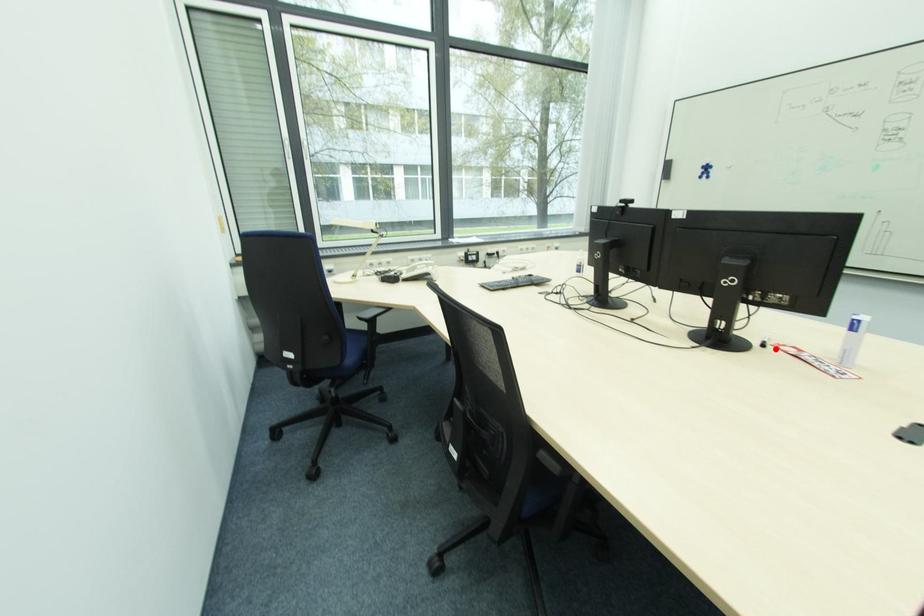
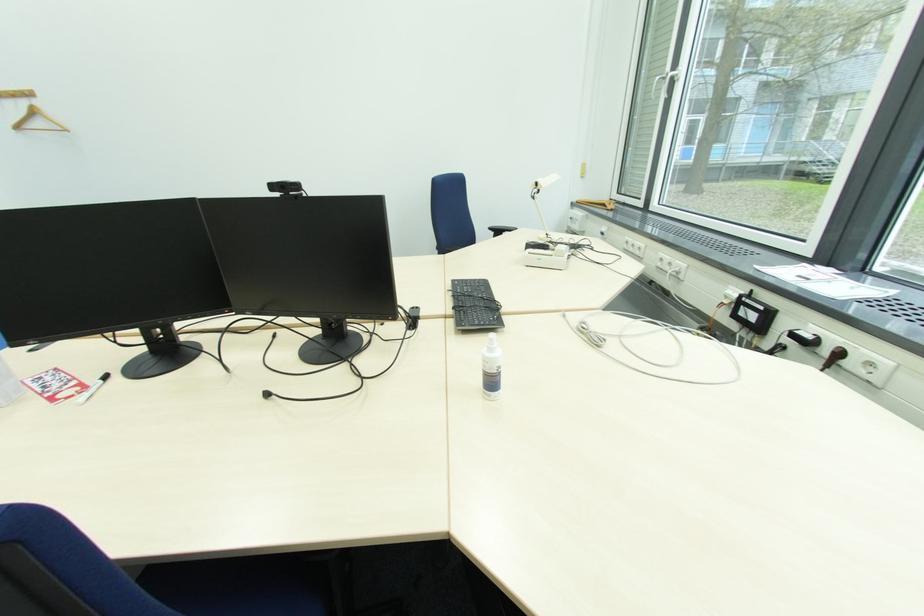
In the second image, find the point that corresponds to the highlighted location in the first image.

(100, 384)